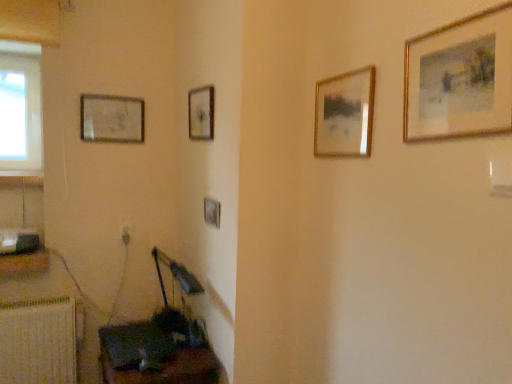
Question: Considering the relative positions of wooden frame painting at center, arranged as the 2th picture frame when viewed from the front, and wooden picture frame at lower left, the 3th picture frame when ordered from right to left, in the image provided, is wooden frame painting at center, arranged as the 2th picture frame when viewed from the front, to the right of wooden picture frame at lower left, the 3th picture frame when ordered from right to left, from the viewer's perspective?

Choices:
 (A) yes
 (B) no

Answer: (A)

Question: Is wooden frame painting at center, the 2th picture frame in the right-to-left sequence, outside of wooden picture frame at lower left, the 3th picture frame positioned from the left?

Choices:
 (A) no
 (B) yes

Answer: (B)

Question: Is wooden frame painting at center, the 2th picture frame in the right-to-left sequence, far from wooden picture frame at lower left, the 3th picture frame positioned from the left?

Choices:
 (A) yes
 (B) no

Answer: (B)

Question: Is wooden frame painting at center, arranged as the fourth picture frame when viewed from the left, facing away from wooden picture frame at lower left, acting as the third picture frame starting from the front?

Choices:
 (A) no
 (B) yes

Answer: (A)

Question: Is the depth of wooden frame painting at center, which is counted as the 4th picture frame, starting from the back, greater than that of wooden picture frame at lower left, the 3th picture frame positioned from the left?

Choices:
 (A) yes
 (B) no

Answer: (B)

Question: Is wooden frame painting at center, arranged as the fourth picture frame when viewed from the left, closer to camera compared to wooden picture frame at lower left, the 3th picture frame positioned from the left?

Choices:
 (A) no
 (B) yes

Answer: (B)

Question: Is wooden dark brown table at lower left positioned in front of wooden picture frame at lower left, acting as the 3th picture frame starting from the back?

Choices:
 (A) no
 (B) yes

Answer: (B)

Question: Can you confirm if wooden dark brown table at lower left is taller than wooden picture frame at lower left, acting as the 3th picture frame starting from the back?

Choices:
 (A) no
 (B) yes

Answer: (B)

Question: Can you confirm if wooden dark brown table at lower left is bigger than wooden picture frame at lower left, the 3th picture frame positioned from the left?

Choices:
 (A) yes
 (B) no

Answer: (A)

Question: Considering the relative positions of wooden dark brown table at lower left and wooden picture frame at lower left, acting as the 3th picture frame starting from the back, in the image provided, is wooden dark brown table at lower left to the right of wooden picture frame at lower left, acting as the 3th picture frame starting from the back, from the viewer's perspective?

Choices:
 (A) no
 (B) yes

Answer: (A)

Question: Can you confirm if wooden dark brown table at lower left is wider than wooden picture frame at lower left, acting as the 3th picture frame starting from the back?

Choices:
 (A) yes
 (B) no

Answer: (A)

Question: Can you confirm if wooden dark brown table at lower left is positioned to the left of wooden picture frame at lower left, the 3th picture frame when ordered from right to left?

Choices:
 (A) no
 (B) yes

Answer: (B)

Question: From a real-world perspective, is gold-framed painting at upper right, the first picture frame in the right-to-left sequence, on top of wooden dark brown table at lower left?

Choices:
 (A) yes
 (B) no

Answer: (A)